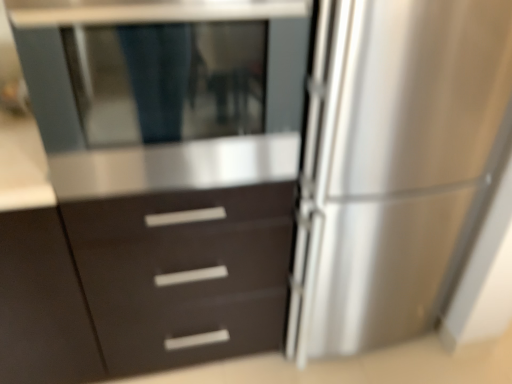
The height and width of the screenshot is (384, 512). Describe the element at coordinates (164, 91) in the screenshot. I see `transparent glass door at upper center` at that location.

Locate an element on the screen. This screenshot has width=512, height=384. transparent glass door at upper center is located at coordinates (164, 91).

Locate an element on the screen. The width and height of the screenshot is (512, 384). transparent glass door at upper center is located at coordinates (164, 91).